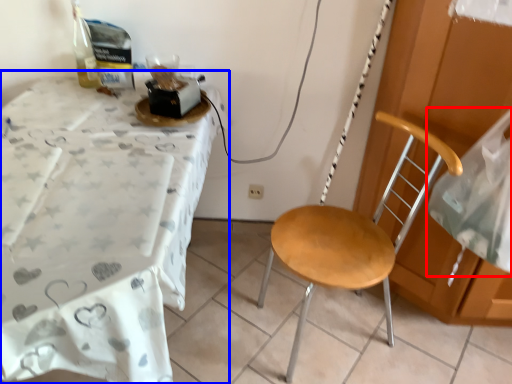
Question: Among these objects, which one is farthest to the camera, sheet (highlighted by a red box) or desk (highlighted by a blue box)?

Choices:
 (A) sheet
 (B) desk

Answer: (A)